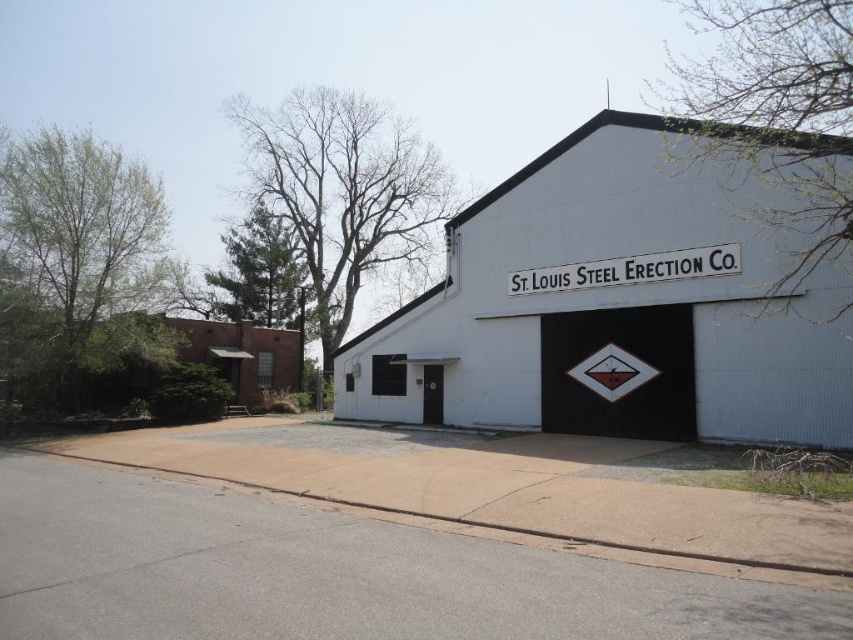
Question: Which point appears farthest from the camera in this image?

Choices:
 (A) (598, 388)
 (B) (585, 284)

Answer: (B)

Question: Is white painted signboard at center positioned behind white diamond-shaped sign at center?

Choices:
 (A) yes
 (B) no

Answer: (B)

Question: Among these objects, which one is nearest to the camera?

Choices:
 (A) white diamond-shaped sign at center
 (B) white painted signboard at center

Answer: (B)

Question: Does white painted signboard at center appear on the right side of white diamond-shaped sign at center?

Choices:
 (A) yes
 (B) no

Answer: (A)

Question: In this image, where is white painted signboard at center located relative to white diamond-shaped sign at center?

Choices:
 (A) left
 (B) right

Answer: (B)